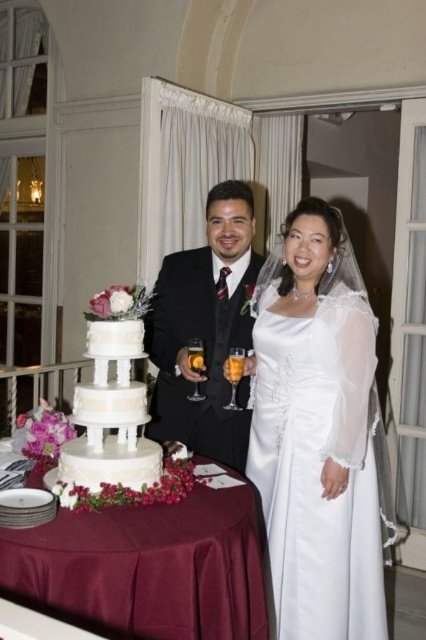
In the wedding scene, you see the white satin wedding dress at center and the maroon satin tablecloth at center. Which object is positioned to the right side?

The white satin wedding dress at center is to the right of the maroon satin tablecloth at center.

You are a photographer standing at the point marked by the coordinates point (x=5, y=582). You want to take a photo of the wedding cake located at point (x=245, y=301). Will the photographer be able to see the cake clearly without any obstruction?

Yes, the photographer at point (x=5, y=582) will be able to see the wedding cake at point (x=245, y=301) clearly because point (x=5, y=582) is in front of point (x=245, y=301), meaning there are no obstructions between them.

You are a photographer at the wedding. You need to position yourself so that both the maroon satin tablecloth at center and the shiny black suit at center are in your camera frame. Which object should you ensure is closer to the center of your frame to include both in the shot?

The maroon satin tablecloth at center is wider than the shiny black suit at center. To include both in the frame, position the wider maroon satin tablecloth at center closer to the center of your frame so that it accommodates its larger width while still capturing the shiny black suit at center.